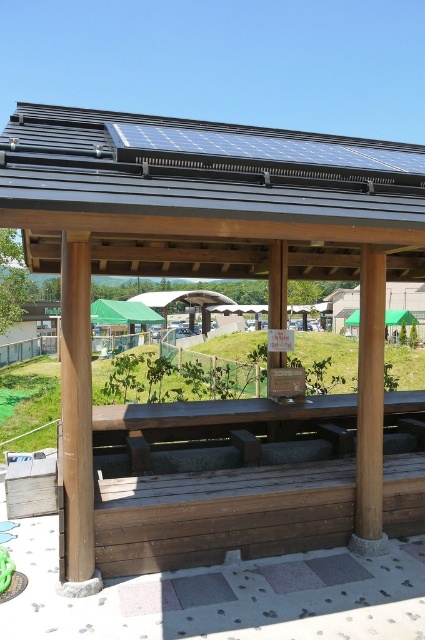
Question: Among these objects, which one is nearest to the camera?

Choices:
 (A) black solar panel at upper center
 (B) brown wood pillar at left

Answer: (A)

Question: Which of the following is the closest to the observer?

Choices:
 (A) (79, 413)
 (B) (22, 209)

Answer: (B)

Question: Can you confirm if black solar panel at upper center is positioned to the left of brown wood pillar at left?

Choices:
 (A) no
 (B) yes

Answer: (A)

Question: Which point is farther to the camera?

Choices:
 (A) (91, 506)
 (B) (235, 129)

Answer: (B)

Question: Is black solar panel at upper center behind brown wood pillar at left?

Choices:
 (A) yes
 (B) no

Answer: (B)

Question: Is black solar panel at upper center to the left of brown wood pillar at left from the viewer's perspective?

Choices:
 (A) no
 (B) yes

Answer: (A)